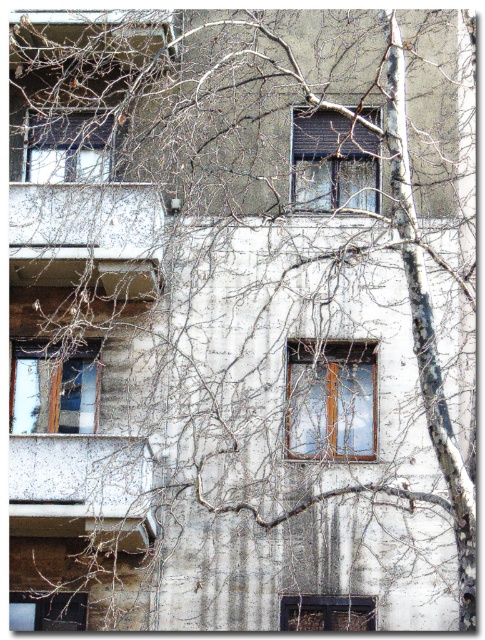
You are a window installer assessing the building. You have two windows to install, a matte black window at center and a wooden frame window at upper center. Which window requires a wider space for installation?

The wooden frame window at upper center requires a wider space for installation since its width is greater than the matte black window at center.

You are standing in front of the building and notice a point at coordinates (330, 401). Based on the scene description, what object is located at this point?

The point at coordinates (330, 401) indicates a clear glass window at center.

You are an architect examining the building facade. You notice the clear glass window at center and the wooden window at left. Which window has a narrower frame?

The clear glass window at center has a narrower frame than the wooden window at left because it is thinner.